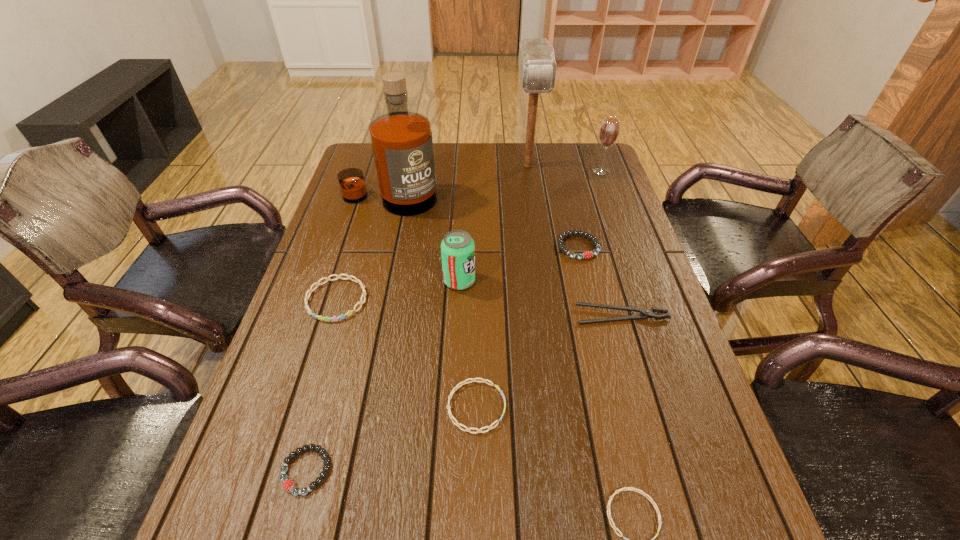
This screenshot has width=960, height=540. In order to click on mallet in this screenshot , I will do `click(537, 67)`.

In order to click on the eighth nearest object in this screenshot , I will do `click(402, 145)`.

This screenshot has width=960, height=540. Identify the location of wineglass. (609, 130).

The image size is (960, 540). What are the coordinates of `red wineglass` in the screenshot? It's located at (609, 130).

Find the location of a particular element. The height and width of the screenshot is (540, 960). pop soda is located at coordinates (457, 248).

I want to click on the fourth nearest bracelet, so click(356, 280).

At what (x,y) coordinates should I click in order to perform the action: click on the biggest blue bracelet. Please return your answer as a coordinate pair (x, y). Looking at the image, I should click on 356,280.

This screenshot has width=960, height=540. I want to click on the seventh nearest object, so click(x=587, y=254).

Identify the location of the farthest bracelet. (587, 254).

In order to click on tongs in this screenshot , I will do `click(645, 313)`.